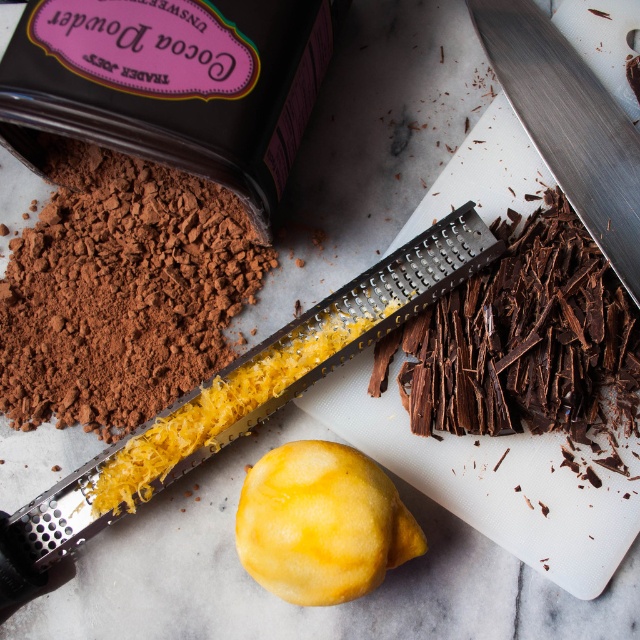
Which of these two, yellow matte lemon at center or polished stainless steel knife at upper right, stands shorter?

yellow matte lemon at center

Can you confirm if yellow matte lemon at center is thinner than polished stainless steel knife at upper right?

No, yellow matte lemon at center is not thinner than polished stainless steel knife at upper right.

Is point (392, 531) more distant than point (588, 74)?

No.

Locate an element on the screen. yellow matte lemon at center is located at coordinates (321, 524).